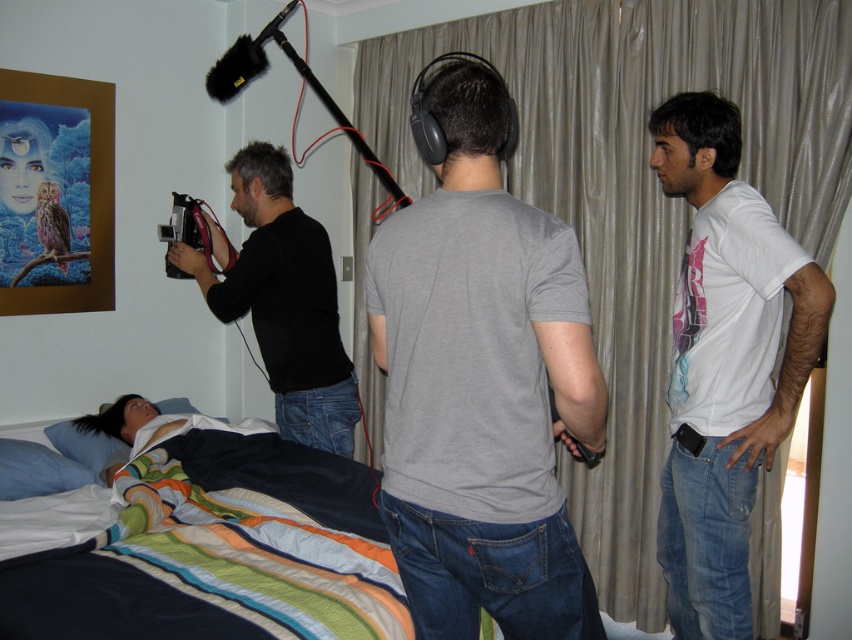
Question: Among these points, which one is farthest from the camera?

Choices:
 (A) (435, 243)
 (B) (701, 465)

Answer: (B)

Question: Observing the image, what is the correct spatial positioning of gray cotton t-shirt at center in reference to black matte camera at center?

Choices:
 (A) left
 (B) right

Answer: (B)

Question: Which of the following is the closest to the observer?

Choices:
 (A) (479, 484)
 (B) (182, 273)

Answer: (A)

Question: Is the position of gray cotton t-shirt at center less distant than that of striped cotton bed at center?

Choices:
 (A) yes
 (B) no

Answer: (A)

Question: Is gray cotton t-shirt at center further to camera compared to white matte t-shirt at right?

Choices:
 (A) yes
 (B) no

Answer: (B)

Question: Which object is farther from the camera taking this photo?

Choices:
 (A) gray cotton t-shirt at center
 (B) black plastic video camera at left

Answer: (B)